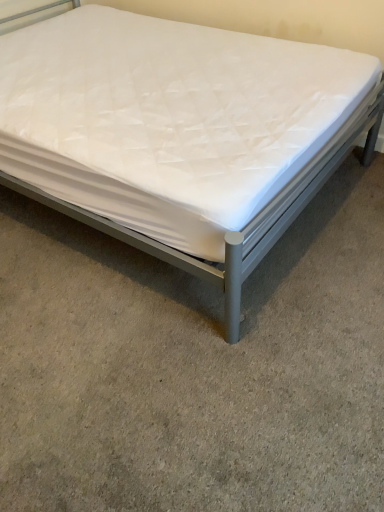
Question: From a real-world perspective, is white quilted mattress at center positioned under white quilted mattress at center based on gravity?

Choices:
 (A) yes
 (B) no

Answer: (A)

Question: From the image's perspective, does white quilted mattress at center appear higher than white quilted mattress at center?

Choices:
 (A) yes
 (B) no

Answer: (B)

Question: Considering the relative sizes of white quilted mattress at center and white quilted mattress at center in the image provided, is white quilted mattress at center bigger than white quilted mattress at center?

Choices:
 (A) no
 (B) yes

Answer: (A)

Question: Is white quilted mattress at center to the right of white quilted mattress at center from the viewer's perspective?

Choices:
 (A) yes
 (B) no

Answer: (A)

Question: Is white quilted mattress at center positioned before white quilted mattress at center?

Choices:
 (A) no
 (B) yes

Answer: (B)

Question: Is white quilted mattress at center at the left side of white quilted mattress at center?

Choices:
 (A) no
 (B) yes

Answer: (A)

Question: Is white quilted mattress at center at the right side of white quilted mattress at center?

Choices:
 (A) no
 (B) yes

Answer: (A)

Question: From the image's perspective, is white quilted mattress at center on top of white quilted mattress at center?

Choices:
 (A) no
 (B) yes

Answer: (B)

Question: Is white quilted mattress at center with white quilted mattress at center?

Choices:
 (A) yes
 (B) no

Answer: (B)

Question: Is white quilted mattress at center positioned behind white quilted mattress at center?

Choices:
 (A) no
 (B) yes

Answer: (B)

Question: Is white quilted mattress at center closer to camera compared to white quilted mattress at center?

Choices:
 (A) yes
 (B) no

Answer: (B)

Question: From the image's perspective, is white quilted mattress at center beneath white quilted mattress at center?

Choices:
 (A) no
 (B) yes

Answer: (A)

Question: From a real-world perspective, is white quilted mattress at center physically located above or below white quilted mattress at center?

Choices:
 (A) above
 (B) below

Answer: (B)